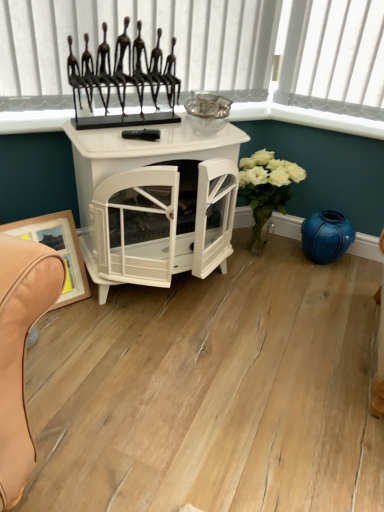
Where is `free space on the front side of wooden framed picture at lower left`? The image size is (384, 512). free space on the front side of wooden framed picture at lower left is located at coordinates (63, 329).